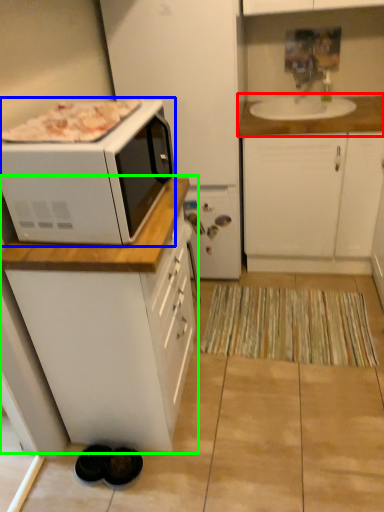
Question: Which object is positioned farthest from countertop (highlighted by a red box)? Select from microwave oven (highlighted by a blue box) and cabinetry (highlighted by a green box).

Choices:
 (A) microwave oven
 (B) cabinetry

Answer: (B)